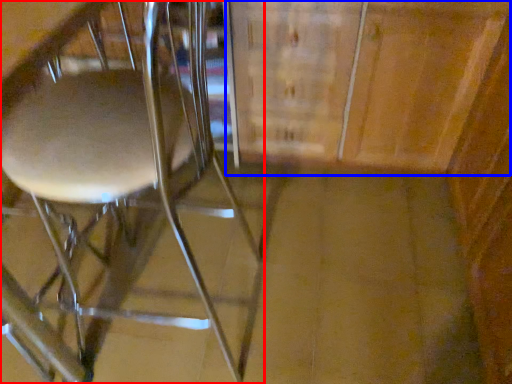
Question: Among these objects, which one is farthest to the camera, chair (highlighted by a red box) or cabinetry (highlighted by a blue box)?

Choices:
 (A) chair
 (B) cabinetry

Answer: (B)